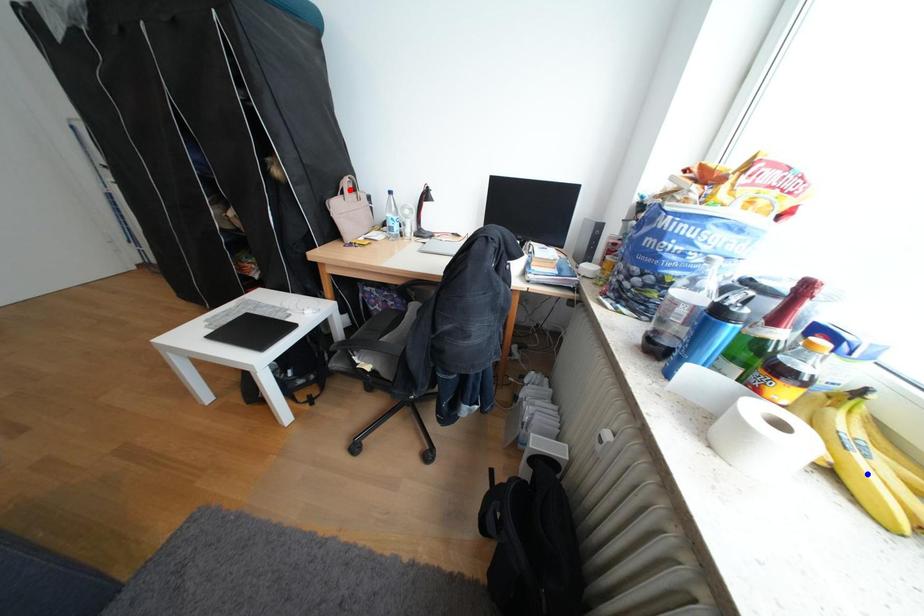
Question: In the image, two points are highlighted. Which point is nearer to the camera? Reply with the corresponding letter.

Choices:
 (A) blue point
 (B) red point

Answer: (A)